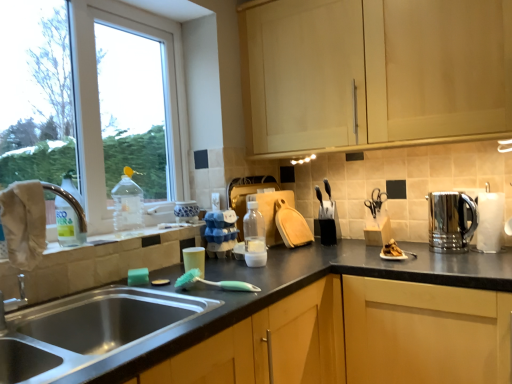
I want to click on blank space to the left of translucent plastic cup at sink, so click(157, 280).